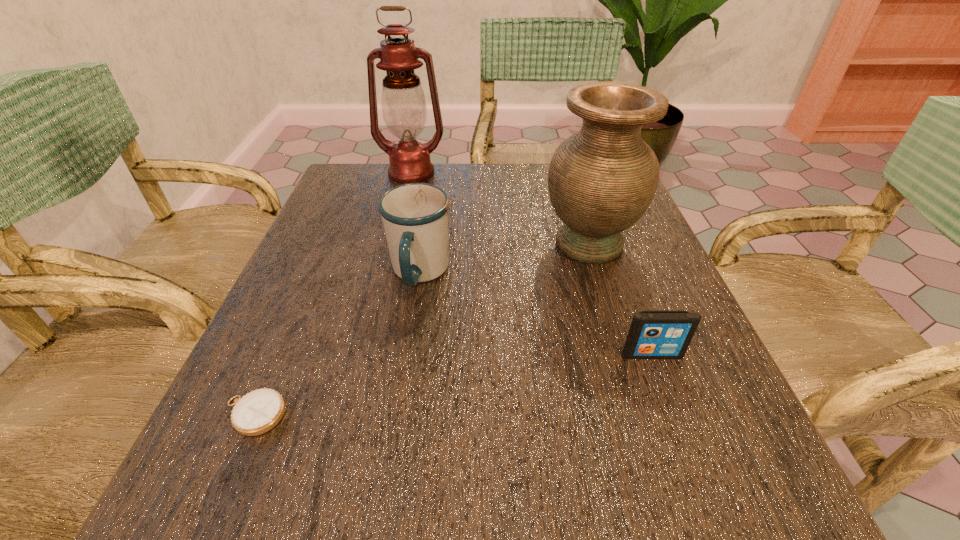
In the image, there is a desktop. Find the location of `free region at the left edge`. free region at the left edge is located at coordinates (345, 369).

The image size is (960, 540). I want to click on blank area at the right edge, so click(602, 314).

I want to click on free point at the far left corner, so point(333,193).

The width and height of the screenshot is (960, 540). In the image, there is a desktop. Identify the location of free space at the near left corner. (243, 500).

In the image, there is a desktop. Identify the location of vacant space at the near right corner. (724, 508).

Locate an element on the screen. The height and width of the screenshot is (540, 960). free space between the mug and the fourth farthest object is located at coordinates (536, 314).

You are a GUI agent. You are given a task and a screenshot of the screen. Output one action in this format:
    pyautogui.click(x=<x>, y=<y>)
    Task: Click on the vacant area that lies between the iPod and the oil lamp
    The image size is (960, 540).
    Given the screenshot: What is the action you would take?
    pyautogui.click(x=532, y=264)

Identify the location of free space between the farthest object and the compass. Image resolution: width=960 pixels, height=540 pixels. (332, 294).

The width and height of the screenshot is (960, 540). Identify the location of vacant space in between the compass and the second tallest object. (421, 329).

Find the location of a particular element. This screenshot has height=540, width=960. vacant region between the fourth farthest object and the shortest object is located at coordinates [x=453, y=384].